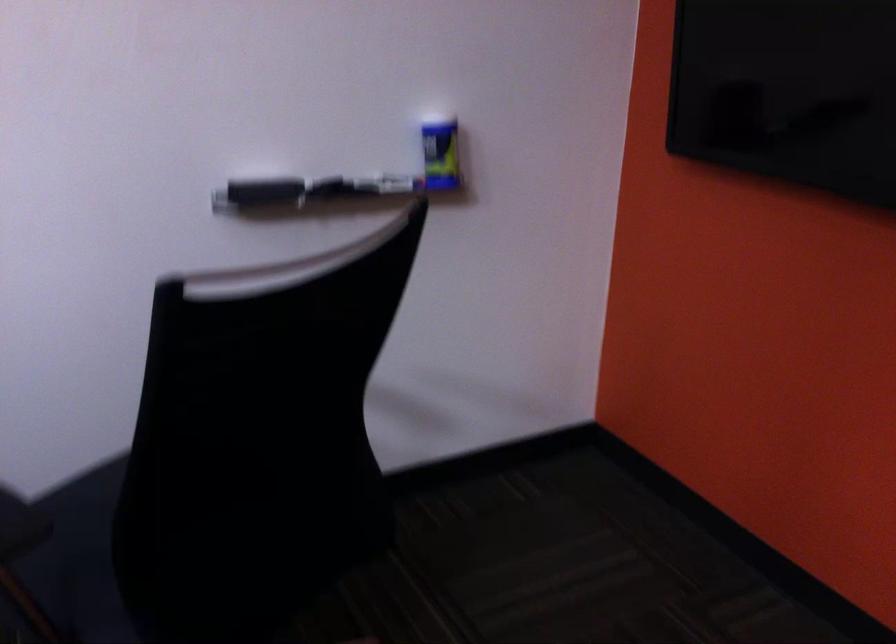
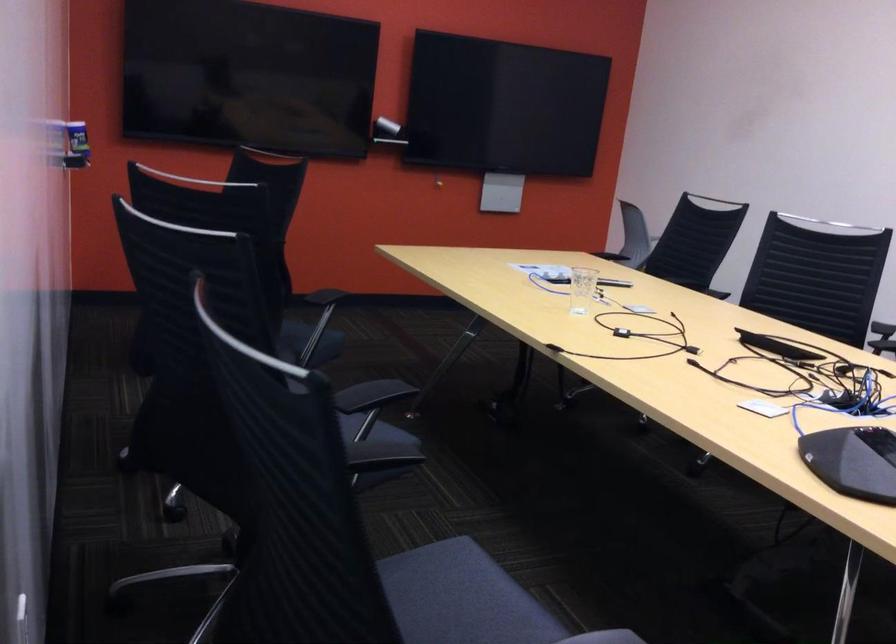
Question: I am providing you with two images of the same scene from different viewpoints. After the viewpoint changes to image2, which objects are now occluded?

Choices:
 (A) silver beverage can
 (B) clear drinking glass
 (C) black conference phone
 (D) black marker

Answer: (D)